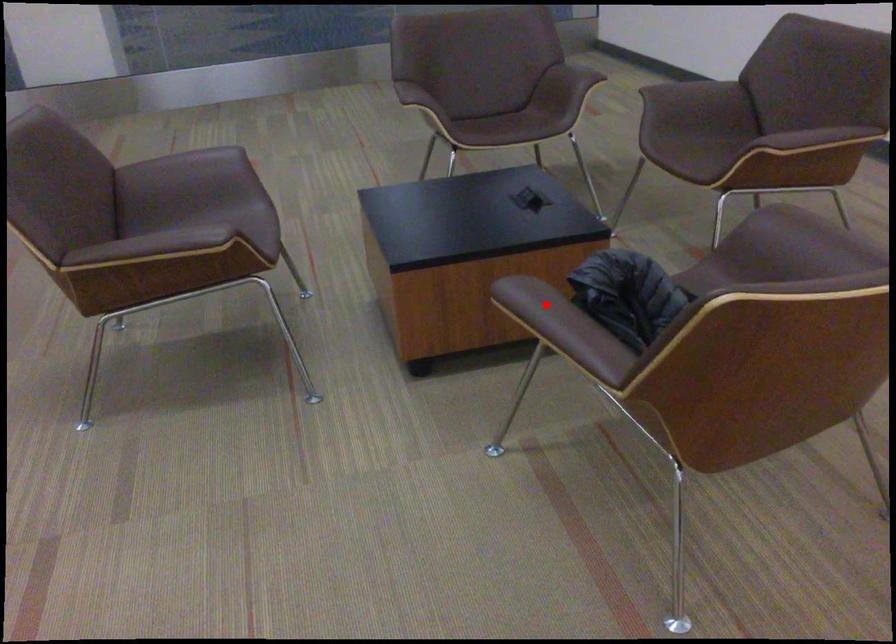
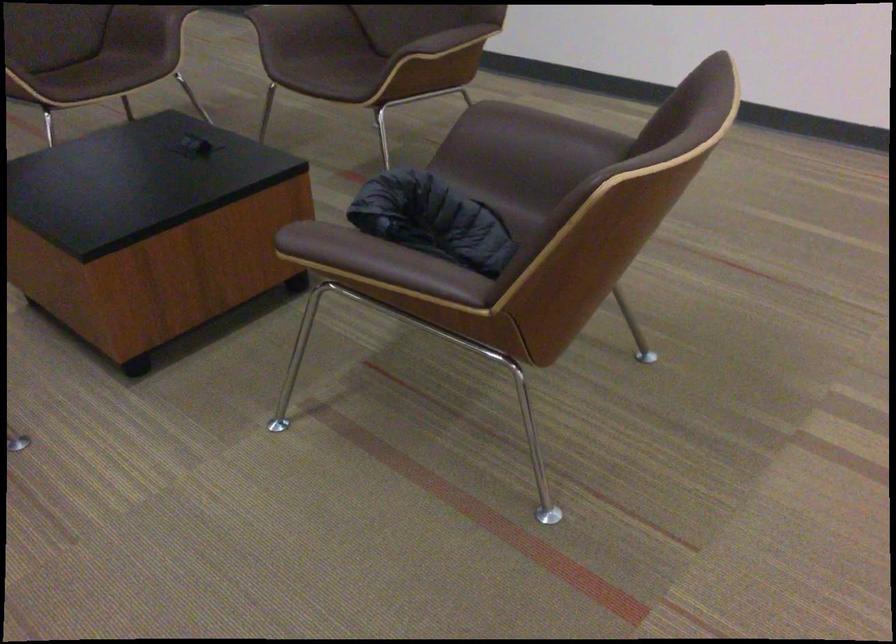
Where in the second image is the point corresponding to the highlighted location from the first image?

(355, 250)